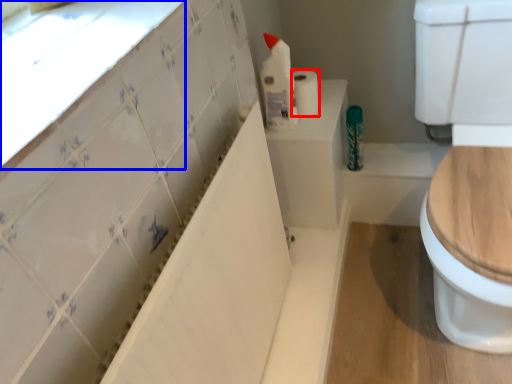
Question: Which object is closer to the camera taking this photo, toilet paper (highlighted by a red box) or window sill (highlighted by a blue box)?

Choices:
 (A) toilet paper
 (B) window sill

Answer: (B)